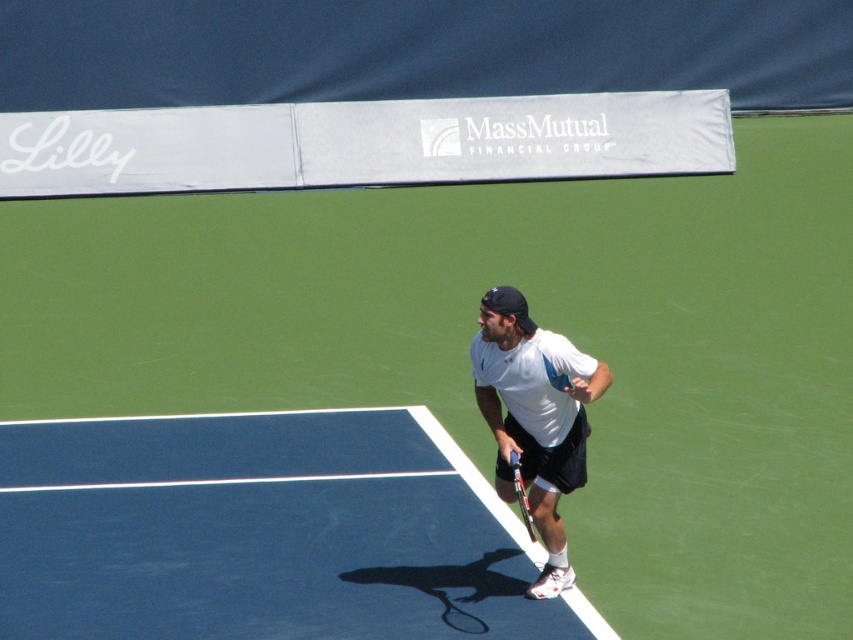
Between white matte tennis racket at center and black metallic tennis racket at lower center, which one is positioned higher?

white matte tennis racket at center

Between point (503, 484) and point (527, 532), which one is positioned behind?

Positioned behind is point (503, 484).

Where is `white matte tennis racket at center`? The width and height of the screenshot is (853, 640). white matte tennis racket at center is located at coordinates (535, 417).

Is point (466, 467) positioned in front of point (509, 481)?

That is False.

Which is in front, point (306, 515) or point (577, 396)?

Point (577, 396) is more forward.

Which is in front, point (386, 605) or point (567, 579)?

Point (386, 605) is more forward.

The height and width of the screenshot is (640, 853). What are the coordinates of `blue rubber tennis court at center` in the screenshot? It's located at (260, 531).

Looking at this image, does blue rubber tennis court at center come behind black metallic tennis racket at lower center?

Yes, it is behind black metallic tennis racket at lower center.

Which is in front, point (372, 492) or point (515, 488)?

Positioned in front is point (515, 488).

The height and width of the screenshot is (640, 853). In order to click on blue rubber tennis court at center in this screenshot , I will do `click(260, 531)`.